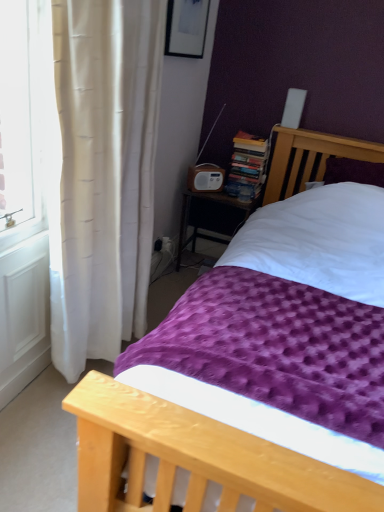
Question: Should I look upward or downward to see white plastic radio at center?

Choices:
 (A) up
 (B) down

Answer: (A)

Question: Is white plastic radio at center to the right of purple textured blanket at center from the viewer's perspective?

Choices:
 (A) yes
 (B) no

Answer: (B)

Question: From a real-world perspective, is white plastic radio at center positioned under purple textured blanket at center based on gravity?

Choices:
 (A) no
 (B) yes

Answer: (A)

Question: Does white plastic radio at center have a smaller size compared to purple textured blanket at center?

Choices:
 (A) no
 (B) yes

Answer: (B)

Question: Is white plastic radio at center in front of purple textured blanket at center?

Choices:
 (A) no
 (B) yes

Answer: (A)

Question: Is white plastic radio at center not close to purple textured blanket at center?

Choices:
 (A) no
 (B) yes

Answer: (B)

Question: From a real-world perspective, is white plastic radio at center physically above purple textured blanket at center?

Choices:
 (A) yes
 (B) no

Answer: (A)

Question: Does wooden radio at center have a lesser width compared to white plastic radio at center?

Choices:
 (A) yes
 (B) no

Answer: (B)

Question: From a real-world perspective, is wooden radio at center over white plastic radio at center?

Choices:
 (A) no
 (B) yes

Answer: (A)

Question: Considering the relative sizes of wooden radio at center and white plastic radio at center in the image provided, is wooden radio at center wider than white plastic radio at center?

Choices:
 (A) yes
 (B) no

Answer: (A)

Question: From the image's perspective, does wooden radio at center appear higher than white plastic radio at center?

Choices:
 (A) no
 (B) yes

Answer: (A)

Question: From a real-world perspective, is wooden radio at center below white plastic radio at center?

Choices:
 (A) yes
 (B) no

Answer: (A)

Question: From the image's perspective, is wooden radio at center located beneath white plastic radio at center?

Choices:
 (A) no
 (B) yes

Answer: (B)

Question: Does hardcover books at center appear on the left side of wooden radio at center?

Choices:
 (A) no
 (B) yes

Answer: (A)